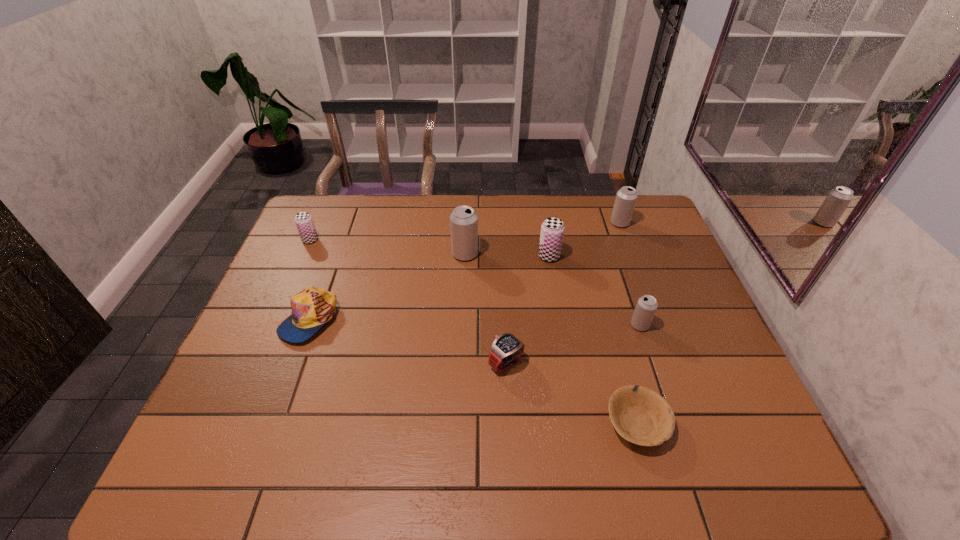
Where is `blank space at the left edge of the desktop`? blank space at the left edge of the desktop is located at coordinates (252, 318).

You are a GUI agent. You are given a task and a screenshot of the screen. Output one action in this format:
    pyautogui.click(x=<x>, y=<y>)
    Task: Click on the free spot at the right edge of the desktop
    This screenshot has height=540, width=960.
    Given the screenshot: What is the action you would take?
    pyautogui.click(x=684, y=419)

Locate an element on the screen. This screenshot has width=960, height=540. blank space at the far left corner of the desktop is located at coordinates (312, 199).

At what (x,y) coordinates should I click in order to perform the action: click on free spot between the farther purple beer can and the bowl. Please return your answer as a coordinate pair (x, y). The width and height of the screenshot is (960, 540). Looking at the image, I should click on (473, 332).

At what (x,y) coordinates should I click in order to perform the action: click on free space between the cap and the nearest object. Please return your answer as a coordinate pair (x, y). The width and height of the screenshot is (960, 540). Looking at the image, I should click on (473, 371).

Where is `vacant space in between the fifth object from right to left and the biggest white beer can`? vacant space in between the fifth object from right to left and the biggest white beer can is located at coordinates (486, 308).

Identify the location of vacant space that's between the bigger purple beer can and the farthest beer can. The width and height of the screenshot is (960, 540). (585, 239).

Image resolution: width=960 pixels, height=540 pixels. Identify the location of free area in between the cap and the nearest object. (473, 371).

Locate an element on the screen. free space between the fourth object from right to left and the tallest object is located at coordinates (507, 255).

Locate an element on the screen. This screenshot has height=540, width=960. vacant area between the smallest white beer can and the leftmost beer can is located at coordinates click(x=475, y=282).